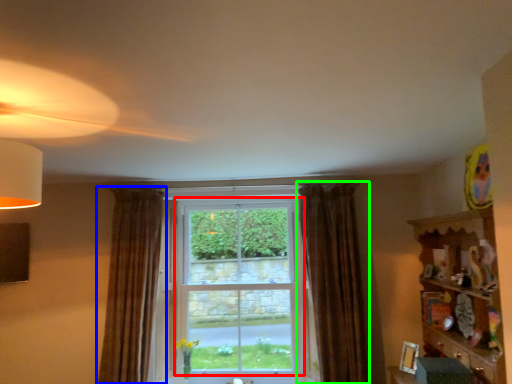
Question: Which is nearer to the window (highlighted by a red box)? curtain (highlighted by a blue box) or curtain (highlighted by a green box).

Choices:
 (A) curtain
 (B) curtain

Answer: (B)